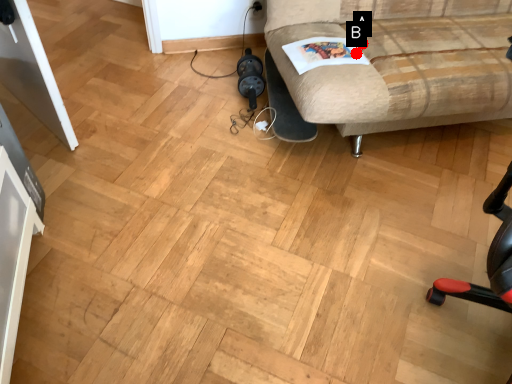
Question: Two points are circled on the image, labeled by A and B beside each circle. Which point is closer to the camera?

Choices:
 (A) A is closer
 (B) B is closer

Answer: (B)